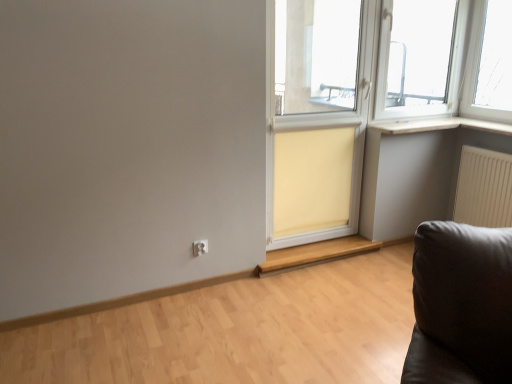
Question: From a real-world perspective, is beige fabric screen door at center on beige fabric curtain at center?

Choices:
 (A) no
 (B) yes

Answer: (B)

Question: Would you say beige fabric screen door at center is outside beige fabric curtain at center?

Choices:
 (A) yes
 (B) no

Answer: (A)

Question: Is beige fabric screen door at center facing away from beige fabric curtain at center?

Choices:
 (A) no
 (B) yes

Answer: (B)

Question: Does beige fabric screen door at center have a smaller size compared to beige fabric curtain at center?

Choices:
 (A) no
 (B) yes

Answer: (A)

Question: Does beige fabric screen door at center have a lesser width compared to beige fabric curtain at center?

Choices:
 (A) no
 (B) yes

Answer: (A)

Question: Is beige fabric screen door at center behind beige fabric curtain at center?

Choices:
 (A) no
 (B) yes

Answer: (A)

Question: Is white matte wood at upper right taller than white plastic electric outlet at lower center?

Choices:
 (A) no
 (B) yes

Answer: (A)

Question: From the image's perspective, is white matte wood at upper right below white plastic electric outlet at lower center?

Choices:
 (A) yes
 (B) no

Answer: (B)

Question: Is white matte wood at upper right facing away from white plastic electric outlet at lower center?

Choices:
 (A) no
 (B) yes

Answer: (A)

Question: From the image's perspective, is white matte wood at upper right located above white plastic electric outlet at lower center?

Choices:
 (A) no
 (B) yes

Answer: (B)

Question: Is white plastic electric outlet at lower center surrounded by white matte wood at upper right?

Choices:
 (A) no
 (B) yes

Answer: (A)

Question: Can you confirm if white matte wood at upper right is wider than white plastic electric outlet at lower center?

Choices:
 (A) no
 (B) yes

Answer: (B)

Question: Does beige fabric curtain at center contain white plastic electric outlet at lower center?

Choices:
 (A) no
 (B) yes

Answer: (A)